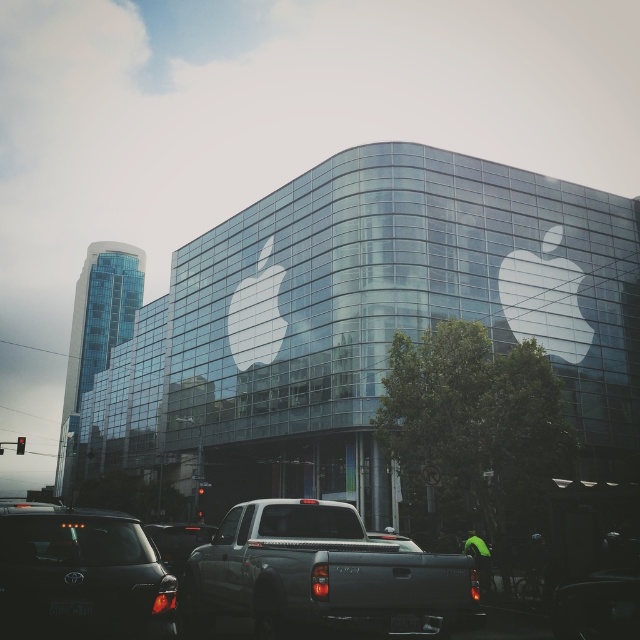
You are standing on the sidewalk in front of the glass building with the Apple logo. You notice two points marked on the ground in front of you. The first point is at coordinates point(420, 579) and the second is at point(129, 577). If you were to walk from the first point to the second, would you be moving towards the building or away from it?

Moving towards the building because point(420, 579) is behind point(129, 577), so walking from the first to the second point would bring you closer to the building.

You are a delivery driver needing to park your 2.5 meter wide van in this scene. You see the matte gray pickup truck at center and the matte black car at lower left. Which parking spot between these two vehicles can accommodate your van?

The matte gray pickup truck at center has a larger width than the matte black car at lower left. Since your van is 2.5 meters wide, you should check the parking spot next to the matte gray pickup truck at center as it might have more space. However, the exact availability depends on the parking spot size, which isn not specified in the scene description.